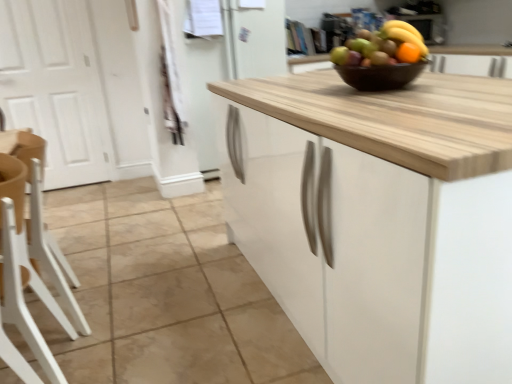
Describe the element at coordinates (55, 87) in the screenshot. The width and height of the screenshot is (512, 384). I see `white matte door at left` at that location.

In order to face white plastic chair at lower left, the 2th chair positioned from the back, should I rotate leftwards or rightwards?

It's best to rotate left around 29.748 degrees.

Where is `white plastic chair at lower left, the 2th chair positioned from the back`? This screenshot has height=384, width=512. white plastic chair at lower left, the 2th chair positioned from the back is located at coordinates (22, 294).

Locate an element on the screen. white wood chair at left, the 1th chair viewed from the back is located at coordinates [x=51, y=250].

At what (x,y) coordinates should I click in order to perform the action: click on yellow matte bananas at upper center. Please return your answer as a coordinate pair (x, y). The width and height of the screenshot is (512, 384). Looking at the image, I should click on (405, 34).

The width and height of the screenshot is (512, 384). Find the location of `natural stone tile at center`. natural stone tile at center is located at coordinates (165, 294).

At what (x,y) coordinates should I click in order to perform the action: click on door on the left of yellow matte bananas at upper center. Please return your answer as a coordinate pair (x, y). Looking at the image, I should click on (55, 87).

In the image, is white matte door at left positioned in front of or behind yellow matte bananas at upper center?

In the image, white matte door at left appears in front of yellow matte bananas at upper center.

Measure the distance between white matte door at left and yellow matte bananas at upper center.

They are 2.85 meters apart.

Would you say white matte door at left is a long distance from yellow matte bananas at upper center?

Indeed, white matte door at left is not near yellow matte bananas at upper center.

Is natural stone tile at center at the back of yellow matte bananas at upper center?

yellow matte bananas at upper center is not turned away from natural stone tile at center.

How much distance is there between yellow matte bananas at upper center and natural stone tile at center?

yellow matte bananas at upper center and natural stone tile at center are 1.62 meters apart from each other.

Is natural stone tile at center inside yellow matte bananas at upper center?

No, natural stone tile at center is not inside yellow matte bananas at upper center.

Is point (405, 24) closer to viewer compared to point (214, 243)?

Yes, it is.

Does white matte door at left have a smaller size compared to white plastic chair at lower left, the 2th chair positioned from the back?

Incorrect, white matte door at left is not smaller in size than white plastic chair at lower left, the 2th chair positioned from the back.

From the image's perspective, is white matte door at left above or below white plastic chair at lower left, the 2th chair positioned from the back?

Based on their image positions, white matte door at left is located above white plastic chair at lower left, the 2th chair positioned from the back.

Is white matte door at left looking in the opposite direction of white plastic chair at lower left, the 2th chair positioned from the back?

white matte door at left is not turned away from white plastic chair at lower left, the 2th chair positioned from the back.

Is orange matte grapefruit at upper center far from white wood chair at left, the 1th chair viewed from the back?

Yes, orange matte grapefruit at upper center and white wood chair at left, the 1th chair viewed from the back, are located far from each other.

From the image's perspective, is orange matte grapefruit at upper center located beneath white wood chair at left, which is the 2th chair from front to back?

Actually, orange matte grapefruit at upper center appears above white wood chair at left, which is the 2th chair from front to back, in the image.

From a real-world perspective, is orange matte grapefruit at upper center physically above white wood chair at left, the 1th chair viewed from the back?

Yes, from a real-world perspective, orange matte grapefruit at upper center is over white wood chair at left, the 1th chair viewed from the back

Based on the photo, which object is positioned more to the right, orange matte grapefruit at upper center or white wood chair at left, the 1th chair viewed from the back?

Positioned to the right is orange matte grapefruit at upper center.

Locate an element on the screen. The width and height of the screenshot is (512, 384). grapefruit below the yellow matte bananas at upper center (from the image's perspective) is located at coordinates (382, 46).

From a real-world perspective, is orange matte grapefruit at upper center positioned above or below yellow matte bananas at upper center?

Clearly, from a real-world perspective, orange matte grapefruit at upper center is above yellow matte bananas at upper center.

Considering the sizes of objects orange matte grapefruit at upper center and yellow matte bananas at upper center in the image provided, who is thinner, orange matte grapefruit at upper center or yellow matte bananas at upper center?

Thinner between the two is orange matte grapefruit at upper center.

Is black glossy bowl at center with white plastic chair at lower left, the 2th chair positioned from the back?

No, black glossy bowl at center is not beside white plastic chair at lower left, the 2th chair positioned from the back.

Does black glossy bowl at center appear on the left side of white plastic chair at lower left, the 2th chair positioned from the back?

No.

In the scene shown: Is black glossy bowl at center inside or outside of white plastic chair at lower left, the 1th chair in the front-to-back sequence?

black glossy bowl at center is not inside white plastic chair at lower left, the 1th chair in the front-to-back sequence, it's outside.

From a real-world perspective, is black glossy bowl at center positioned over white plastic chair at lower left, the 2th chair positioned from the back, based on gravity?

Yes, from a real-world perspective, black glossy bowl at center is over white plastic chair at lower left, the 2th chair positioned from the back

How distant is black glossy bowl at center from white wood chair at left, the 1th chair viewed from the back?

black glossy bowl at center and white wood chair at left, the 1th chair viewed from the back, are 1.30 meters apart.

Considering the points (375, 69) and (64, 287), which point is in front, point (375, 69) or point (64, 287)?

The point (375, 69) is closer to the camera.

From the image's perspective, is black glossy bowl at center above or below white wood chair at left, which is the 2th chair from front to back?

From the image's perspective, black glossy bowl at center appears above white wood chair at left, which is the 2th chair from front to back.

Between black glossy bowl at center and white wood chair at left, which is the 2th chair from front to back, which one appears on the left side from the viewer's perspective?

Positioned to the left is white wood chair at left, which is the 2th chair from front to back.

At what (x,y) coordinates should I click in order to perform the action: click on door located on the left of yellow matte bananas at upper center. Please return your answer as a coordinate pair (x, y). This screenshot has height=384, width=512. Looking at the image, I should click on (55, 87).

You are a GUI agent. You are given a task and a screenshot of the screen. Output one action in this format:
    pyautogui.click(x=<x>, y=<y>)
    Task: Click on the banana that is on the right side of natural stone tile at center
    This screenshot has height=384, width=512.
    Given the screenshot: What is the action you would take?
    pyautogui.click(x=405, y=34)

When comparing their distances from yellow matte bananas at upper center, does white wood chair at left, which is the 2th chair from front to back, or orange matte grapefruit at upper center seem further?

Based on the image, white wood chair at left, which is the 2th chair from front to back, appears to be further to yellow matte bananas at upper center.

When comparing their distances from white matte door at left, does white plastic chair at lower left, the 1th chair in the front-to-back sequence, or yellow matte bananas at upper center seem closer?

white plastic chair at lower left, the 1th chair in the front-to-back sequence, is positioned closer to the anchor white matte door at left.

Based on their spatial positions, is white plastic chair at lower left, the 2th chair positioned from the back, or white matte door at left further from natural stone tile at center?

The object further to natural stone tile at center is white matte door at left.

In the scene shown: When comparing their distances from natural stone tile at center, does white matte door at left or white wood chair at left, which is the 2th chair from front to back, seem closer?

white wood chair at left, which is the 2th chair from front to back, lies closer to natural stone tile at center than the other object.

Estimate the real-world distances between objects in this image. Which object is closer to natural stone tile at center, white matte door at left or yellow matte bananas at upper center?

Among the two, white matte door at left is located nearer to natural stone tile at center.

Estimate the real-world distances between objects in this image. Which object is closer to natural stone tile at center, white matte door at left or black glossy bowl at center?

black glossy bowl at center is closer to natural stone tile at center.

Looking at the image, which one is located closer to white plastic chair at lower left, the 2th chair positioned from the back, orange matte grapefruit at upper center or white wood chair at left, the 1th chair viewed from the back?

white wood chair at left, the 1th chair viewed from the back, is closer to white plastic chair at lower left, the 2th chair positioned from the back.

From the picture: From the image, which object appears to be farther from yellow matte bananas at upper center, natural stone tile at center or white wood chair at left, which is the 2th chair from front to back?

The object further to yellow matte bananas at upper center is natural stone tile at center.

The width and height of the screenshot is (512, 384). Find the location of `tile between white plastic chair at lower left, the 2th chair positioned from the back, and white matte door at left from front to back`. tile between white plastic chair at lower left, the 2th chair positioned from the back, and white matte door at left from front to back is located at coordinates (165, 294).

Where is `chair positioned between white plastic chair at lower left, the 1th chair in the front-to-back sequence, and yellow matte bananas at upper center from near to far`? The height and width of the screenshot is (384, 512). chair positioned between white plastic chair at lower left, the 1th chair in the front-to-back sequence, and yellow matte bananas at upper center from near to far is located at coordinates pyautogui.click(x=51, y=250).

Find the location of a particular element. Image resolution: width=512 pixels, height=384 pixels. chair between black glossy bowl at center and yellow matte bananas at upper center from front to back is located at coordinates (51, 250).

Find the location of a particular element. This screenshot has width=512, height=384. chair located between white wood chair at left, which is the 2th chair from front to back, and natural stone tile at center in the left-right direction is located at coordinates (22, 294).